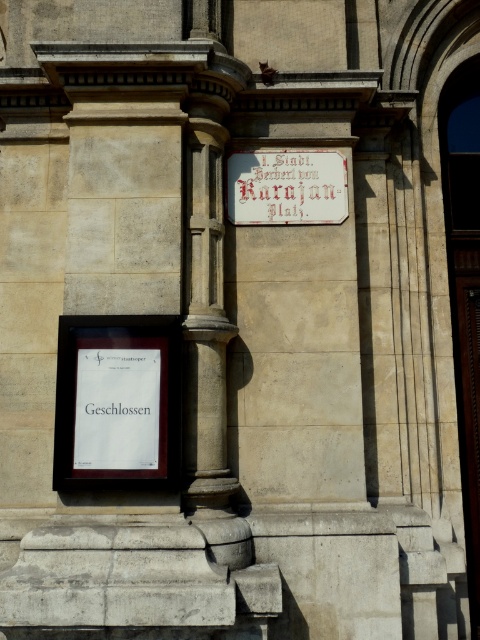
Question: Which point appears farthest from the camera in this image?

Choices:
 (A) (284, 176)
 (B) (98, 360)

Answer: (A)

Question: Is white wood sign at center below white paper sign at lower left?

Choices:
 (A) yes
 (B) no

Answer: (B)

Question: Does white paper poster at lower left have a lesser width compared to white wood sign at center?

Choices:
 (A) no
 (B) yes

Answer: (B)

Question: Estimate the real-world distances between objects in this image. Which object is farther from the white paper poster at lower left?

Choices:
 (A) white wood sign at center
 (B) white paper sign at lower left

Answer: (A)

Question: Which point appears closest to the camera in this image?

Choices:
 (A) (132, 467)
 (B) (347, 204)

Answer: (A)

Question: Is white paper poster at lower left to the right of white paper sign at lower left from the viewer's perspective?

Choices:
 (A) no
 (B) yes

Answer: (A)